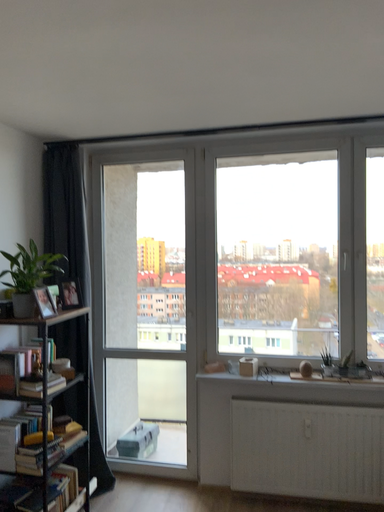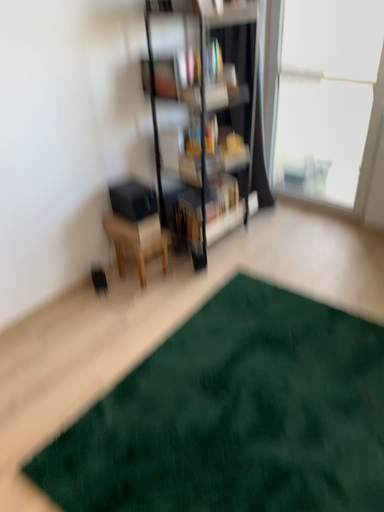
Question: How did the camera likely rotate when shooting the video?

Choices:
 (A) rotated upward
 (B) rotated downward

Answer: (B)